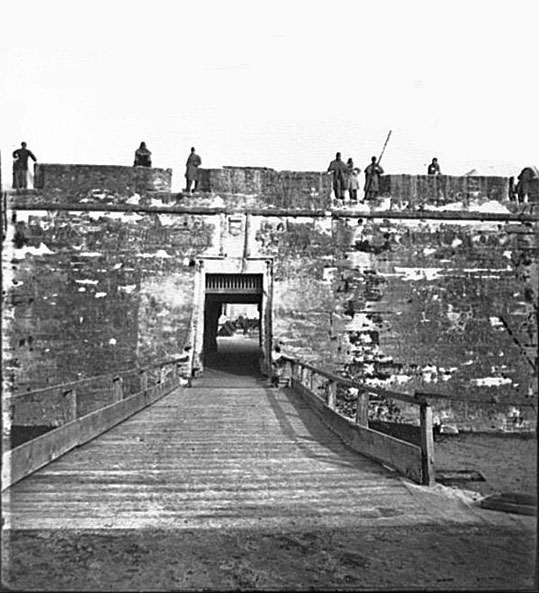
At what (x,y) coordinates should I click in order to perform the action: click on entry way. Please return your answer as a coordinate pair (x, y). This screenshot has height=593, width=539. Looking at the image, I should click on (224, 329).